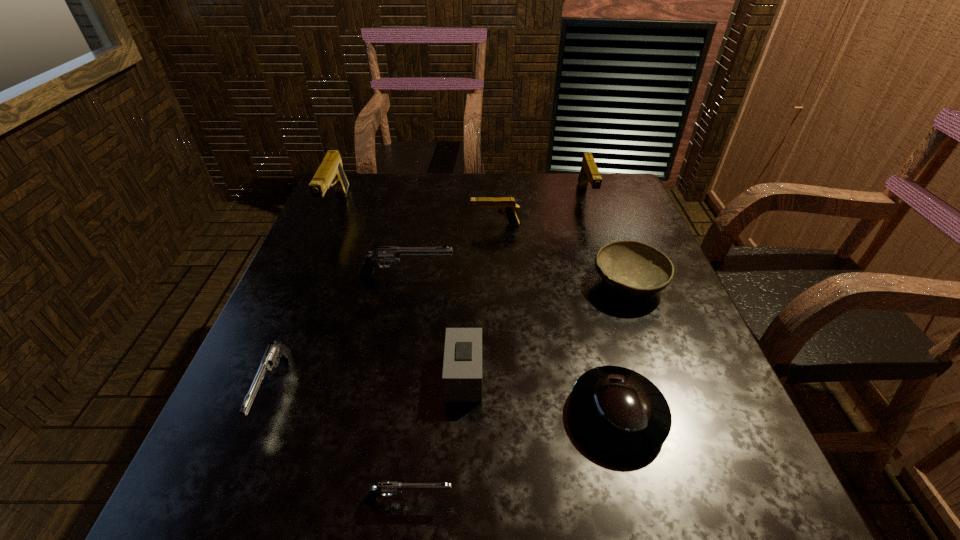
This screenshot has height=540, width=960. What are the coordinates of `vacant point located 0.080m at the barrel of the fifth pistol from left to right` in the screenshot? It's located at (441, 225).

I want to click on free point located 0.220m on the front-facing side of the alarm clock, so click(597, 376).

Identify the location of vacant region located on the front-facing side of the second shortest pistol. (238, 475).

Locate an element on the screen. The width and height of the screenshot is (960, 540). free spot located 0.400m on the back of the gray bowl is located at coordinates (x=590, y=179).

Where is `free space located on the left of the saucer`? free space located on the left of the saucer is located at coordinates (422, 415).

The height and width of the screenshot is (540, 960). Find the location of `vacant space located 0.250m on the front-facing side of the nearest object`. vacant space located 0.250m on the front-facing side of the nearest object is located at coordinates (616, 500).

Locate an element on the screen. The image size is (960, 540). saucer present at the near edge is located at coordinates point(622,411).

This screenshot has width=960, height=540. Find the location of `pistol that is positioned at the near edge`. pistol that is positioned at the near edge is located at coordinates (386, 488).

Where is `pistol located at the right edge`? The height and width of the screenshot is (540, 960). pistol located at the right edge is located at coordinates click(589, 173).

Where is `bowl positioned at the right edge`? The height and width of the screenshot is (540, 960). bowl positioned at the right edge is located at coordinates (633, 268).